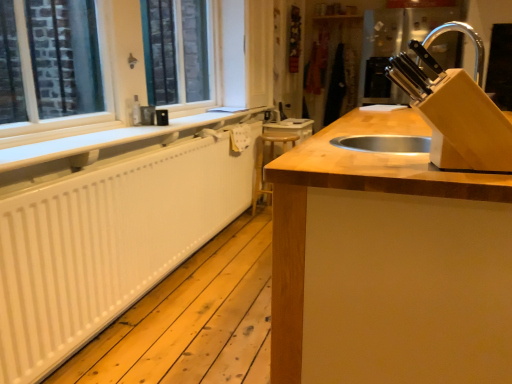
Question: Is white matte radiator at left next to white painted wood at left?

Choices:
 (A) no
 (B) yes

Answer: (A)

Question: Is white matte radiator at left at the left side of white painted wood at left?

Choices:
 (A) yes
 (B) no

Answer: (A)

Question: Is white matte radiator at left turned away from white painted wood at left?

Choices:
 (A) no
 (B) yes

Answer: (A)

Question: From a real-world perspective, is white matte radiator at left located beneath white painted wood at left?

Choices:
 (A) no
 (B) yes

Answer: (B)

Question: Does white matte radiator at left come in front of white painted wood at left?

Choices:
 (A) yes
 (B) no

Answer: (B)

Question: Is white matte radiator at left shorter than white painted wood at left?

Choices:
 (A) yes
 (B) no

Answer: (A)

Question: From a real-world perspective, is wooden at center positioned over wooden at center based on gravity?

Choices:
 (A) yes
 (B) no

Answer: (B)

Question: From the image's perspective, would you say wooden at center is positioned over wooden at center?

Choices:
 (A) no
 (B) yes

Answer: (B)

Question: Can you confirm if wooden at center is thinner than wooden at center?

Choices:
 (A) yes
 (B) no

Answer: (A)

Question: Can you confirm if wooden at center is positioned to the right of wooden at center?

Choices:
 (A) no
 (B) yes

Answer: (A)

Question: Does wooden at center have a smaller size compared to wooden at center?

Choices:
 (A) no
 (B) yes

Answer: (B)

Question: Is wooden at center wider than wooden at center?

Choices:
 (A) yes
 (B) no

Answer: (B)

Question: From the image's perspective, is wooden at center on top of white matte radiator at left?

Choices:
 (A) yes
 (B) no

Answer: (B)